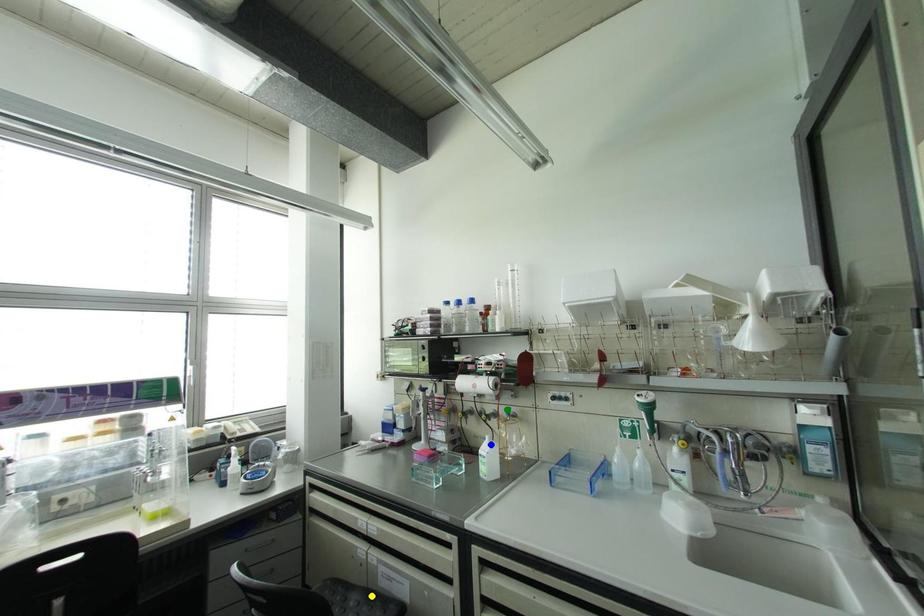
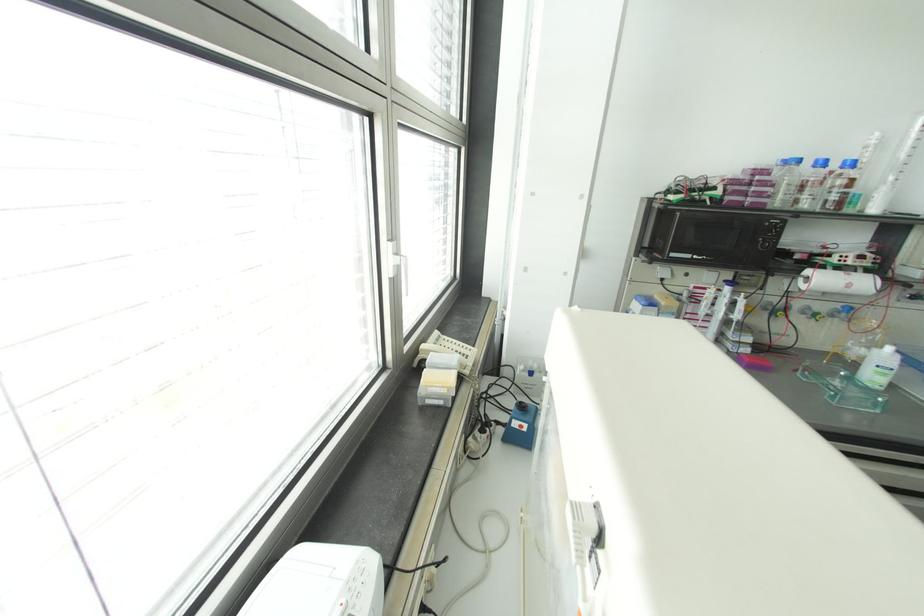
I am providing you with two images of the same scene from different viewpoints. Three points are marked in image1. Which point corresponds to a part or object that is occluded in image2?In image1, three points are marked. Which of them correspond to a part or object that is occluded in image2?Among the three points shown in image1, which one corresponds to a part or object that is no longer visible due to occlusion in image2?

yellow point